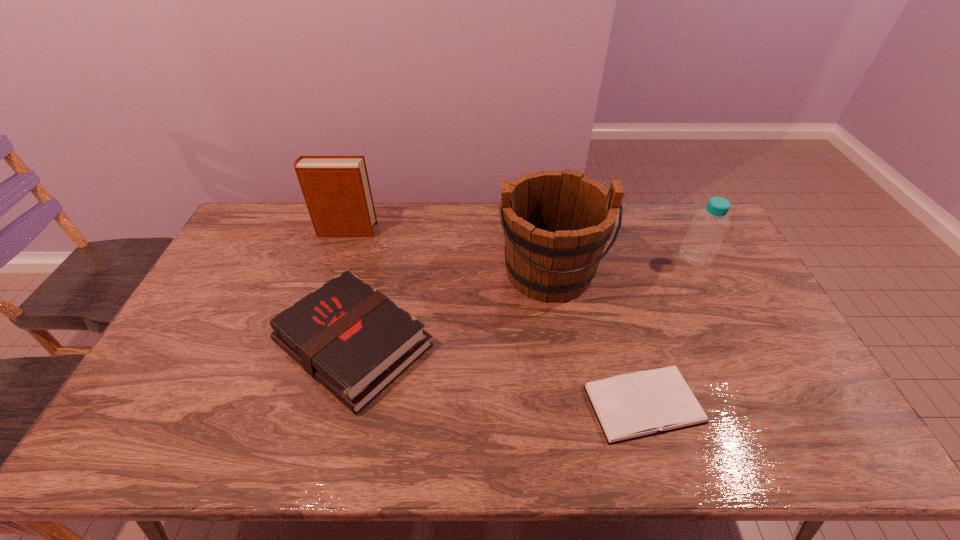
You are a GUI agent. You are given a task and a screenshot of the screen. Output one action in this format:
    pyautogui.click(x=<x>, y=<y>)
    Task: Click on the free region at the right edge of the desktop
    
    Given the screenshot: What is the action you would take?
    pyautogui.click(x=802, y=378)

Where is `unoccupied area between the tallest object and the shortest hardback book`? Image resolution: width=960 pixels, height=540 pixels. unoccupied area between the tallest object and the shortest hardback book is located at coordinates (596, 338).

Locate an element on the screen. The image size is (960, 540). vacant space that is in between the tallest object and the shortest hardback book is located at coordinates (596, 338).

Locate an element on the screen. The height and width of the screenshot is (540, 960). vacant space that's between the tallest object and the second shortest object is located at coordinates (451, 308).

You are a GUI agent. You are given a task and a screenshot of the screen. Output one action in this format:
    pyautogui.click(x=<x>, y=<y>)
    Task: Click on the blank region between the shortest object and the farthest object
    The height and width of the screenshot is (540, 960).
    Given the screenshot: What is the action you would take?
    pyautogui.click(x=494, y=317)

This screenshot has width=960, height=540. I want to click on vacant space that is in between the wine bucket and the rightmost object, so click(622, 265).

In order to click on unoccupied position between the tallest hardback book and the rightmost hardback book in this screenshot , I will do `click(494, 317)`.

Locate an element on the screen. This screenshot has height=540, width=960. vacant area that lies between the tallest hardback book and the shortest hardback book is located at coordinates (494, 317).

Select which object is the second closest to the bottle. Please provide its 2D coordinates. Your answer should be formatted as a tuple, i.e. [(x, y)], where the tuple contains the x and y coordinates of a point satisfying the conditions above.

[(630, 406)]

This screenshot has height=540, width=960. Identify the location of object that is the third closest to the farthest object. (630, 406).